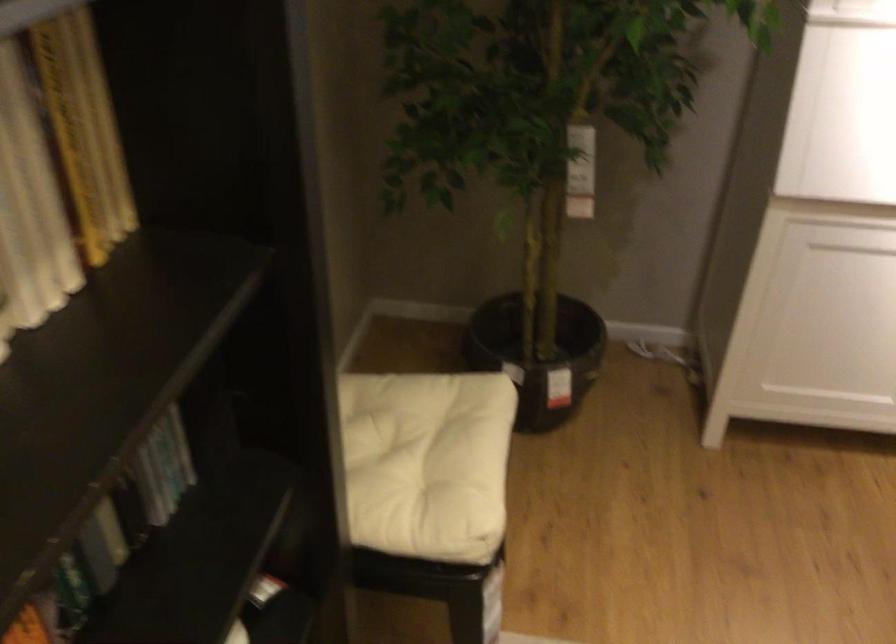
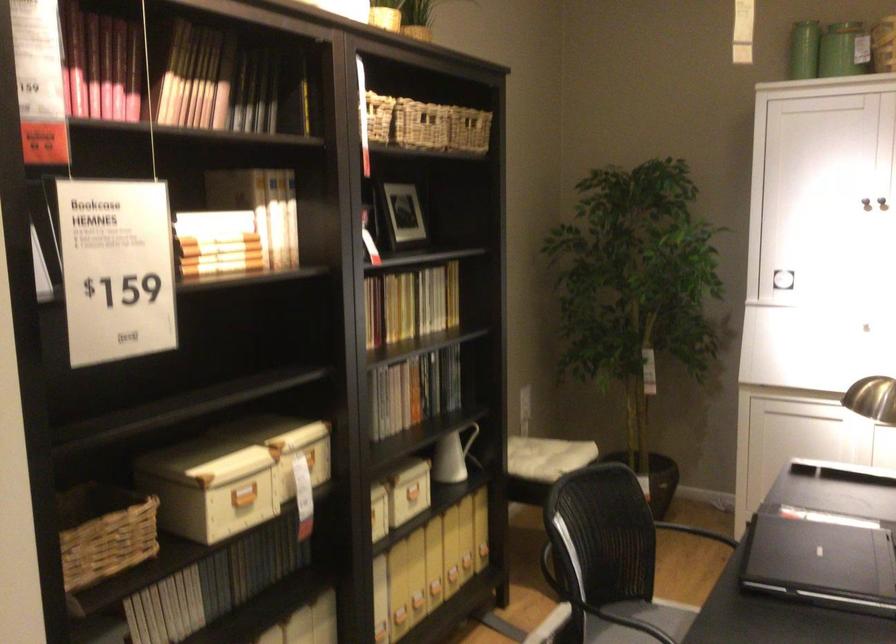
In the second image, find the point that corresponds to point 625,430 in the first image.

(695, 532)